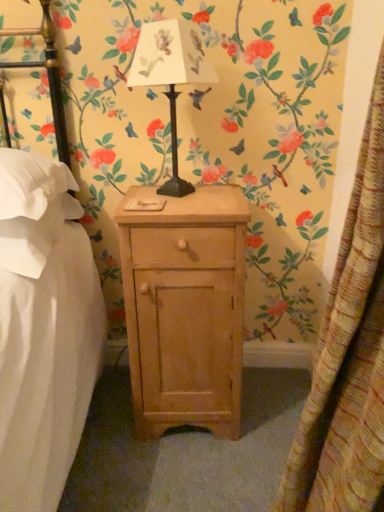
Question: Is white fabric pillow at left, acting as the 1th pillow starting from the bottom, wider or thinner than white soft pillow at left, marked as the 1th pillow in a top-to-bottom arrangement?

Choices:
 (A) thin
 (B) wide

Answer: (B)

Question: Is white fabric pillow at left, acting as the 1th pillow starting from the bottom, inside the boundaries of white soft pillow at left, the 2th pillow from the bottom, or outside?

Choices:
 (A) outside
 (B) inside

Answer: (A)

Question: Which is farther from the white soft pillow at left, the 2th pillow from the bottom?

Choices:
 (A) white fabric pillow at left, the 2th pillow in the top-to-bottom sequence
 (B) light wood nightstand at center
 (C) textured yellow curtain at right
 (D) metallic black table lamp at center

Answer: (C)

Question: Which object is positioned farthest from the white fabric pillow at left, acting as the 1th pillow starting from the bottom?

Choices:
 (A) metallic black table lamp at center
 (B) textured yellow curtain at right
 (C) white soft pillow at left, marked as the 1th pillow in a top-to-bottom arrangement
 (D) light wood nightstand at center

Answer: (B)